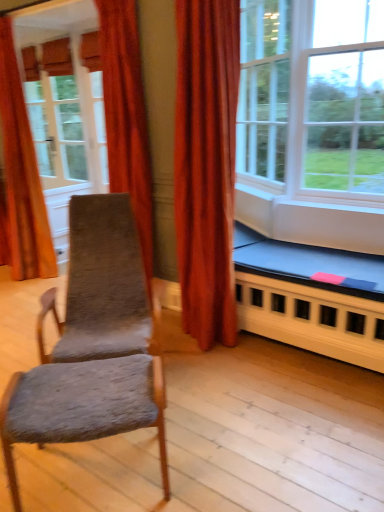
Find the location of a particular element. This screenshot has width=384, height=512. spots to the right of textured gray fabric chair at center is located at coordinates (215, 451).